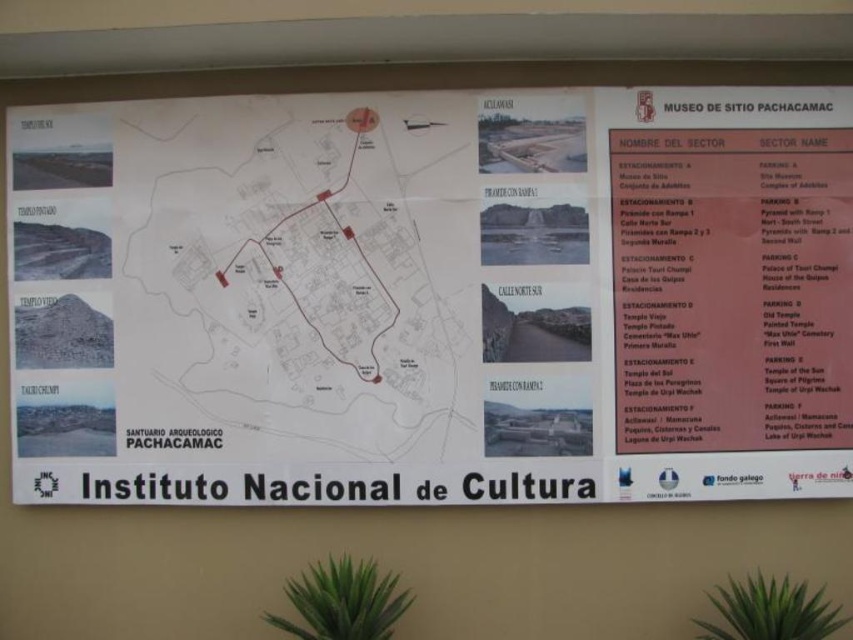
Who is more forward, (x=112, y=500) or (x=310, y=259)?

Point (x=310, y=259)

Can you confirm if white paper map at upper center is thinner than white paper map at center?

No.

The height and width of the screenshot is (640, 853). Identify the location of white paper map at upper center. (433, 296).

You are a GUI agent. You are given a task and a screenshot of the screen. Output one action in this format:
    pyautogui.click(x=<x>, y=<y>)
    Task: Click on the white paper map at upper center
    This screenshot has width=853, height=640.
    Given the screenshot: What is the action you would take?
    433,296